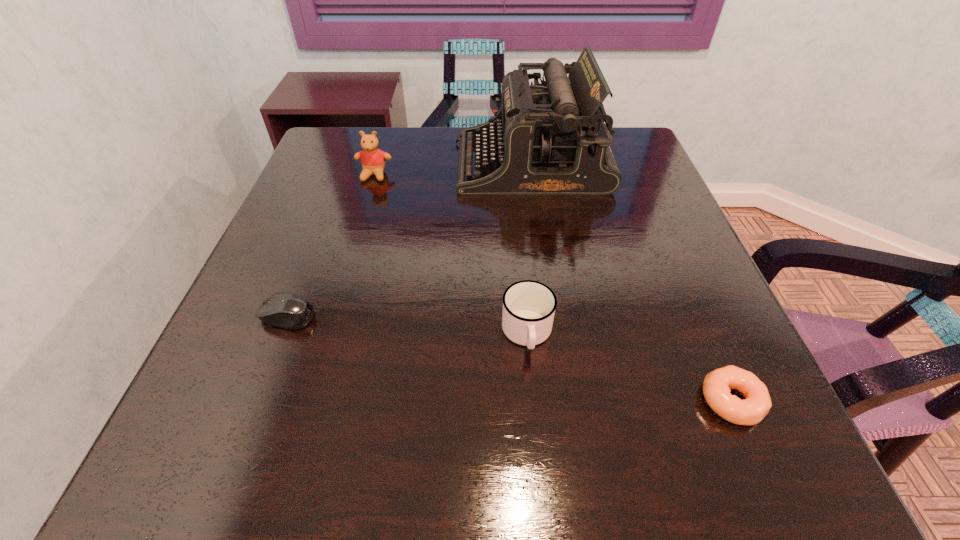
Find the location of a particular element. Image resolution: width=960 pixels, height=540 pixels. object located at the far right corner is located at coordinates (550, 138).

In order to click on free region at the far edge of the desktop in this screenshot , I will do [443, 166].

Identify the location of vacant space at the left edge of the desktop. (292, 342).

In the image, there is a desktop. In order to click on free space at the right edge in this screenshot , I will do `click(672, 319)`.

At what (x,y) coordinates should I click in order to perform the action: click on free space at the far left corner of the desktop. Please return your answer as a coordinate pair (x, y). This screenshot has width=960, height=540. Looking at the image, I should click on pyautogui.click(x=361, y=167).

In the image, there is a desktop. What are the coordinates of `free region at the near left corner` in the screenshot? It's located at (211, 488).

Where is `vacant region at the far right corner of the desktop`? vacant region at the far right corner of the desktop is located at coordinates (621, 168).

You are a GUI agent. You are given a task and a screenshot of the screen. Output one action in this format:
    pyautogui.click(x=<x>, y=<y>)
    Task: Click on the free space between the rightmost object and the tallest object
    The image size is (960, 540).
    Given the screenshot: What is the action you would take?
    pyautogui.click(x=631, y=282)

Identify the location of vacant area between the fourth shortest object and the mouse. The height and width of the screenshot is (540, 960). (331, 245).

Find the location of a particular element. The width and height of the screenshot is (960, 540). vacant space that's between the rightmost object and the fourth shortest object is located at coordinates (553, 288).